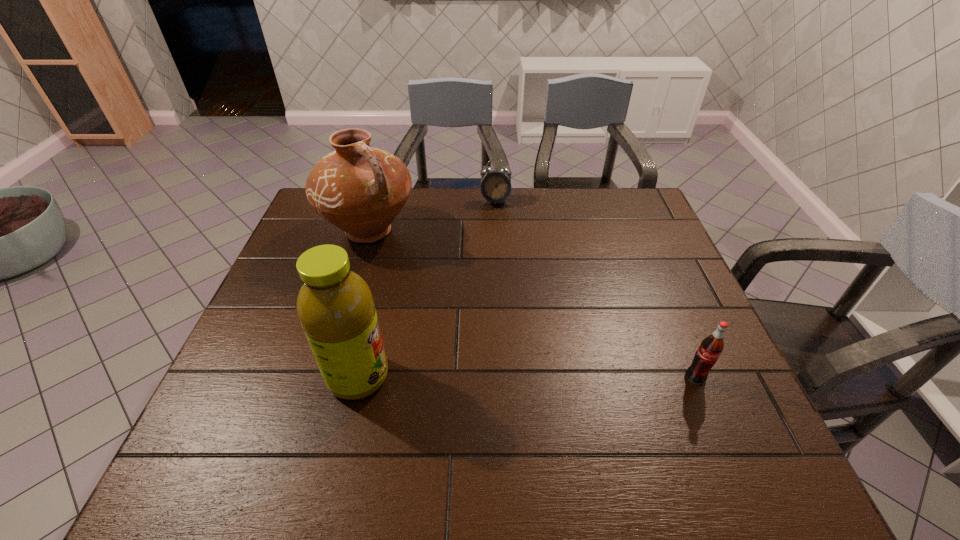
I want to click on vacant space that is in between the third tallest object and the second object from right to left, so click(x=595, y=289).

This screenshot has height=540, width=960. What are the coordinates of `unoccupied position between the pottery and the second object from right to left` in the screenshot? It's located at (432, 216).

The width and height of the screenshot is (960, 540). I want to click on vacant point located between the rightmost object and the pottery, so click(x=532, y=304).

Find the location of a particular element. The image size is (960, 540). free space between the alarm clock and the fruit juice is located at coordinates (427, 289).

Identify the location of empty location between the third object from left to right and the rightmost object. The width and height of the screenshot is (960, 540). (595, 289).

Identify the location of the second closest object relative to the fruit juice. (495, 187).

Select which object is the third closest to the alarm clock. Please provide its 2D coordinates. Your answer should be formatted as a tuple, i.e. [(x, y)], where the tuple contains the x and y coordinates of a point satisfying the conditions above.

[(706, 356)]

I want to click on free space that satisfies the following two spatial constraints: 1. on the front side of the pottery; 2. on the front label of the fruit juice, so click(324, 377).